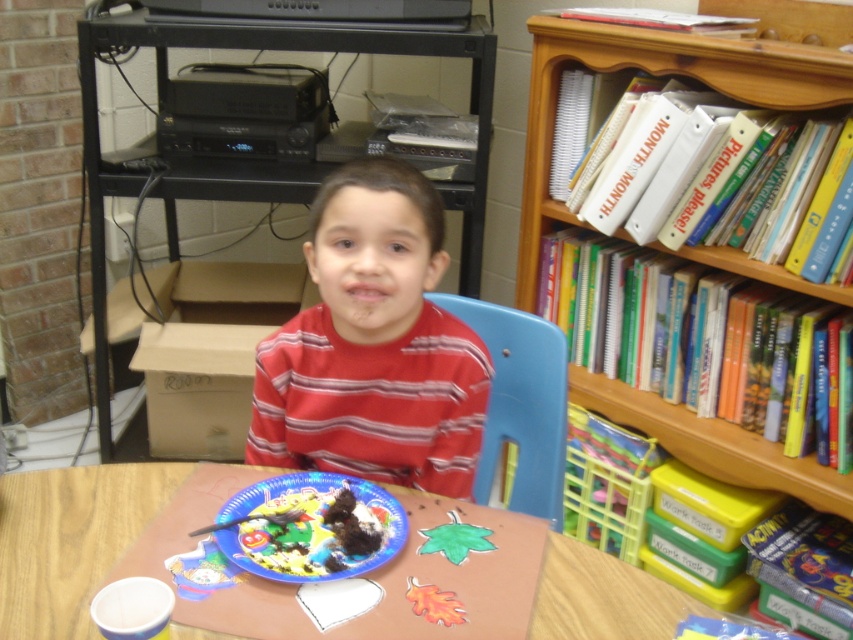
You are standing at the position of the child in the scene. Looking around, where is the wooden bookshelf at upper right located in terms of direction and distance?

The wooden bookshelf at upper right is located at the coordinates point (274, 49), which would be to the upper right direction and relatively close distance from the child.

You are a teacher in a classroom and need to move a desk between the wooden bookshelf at upper right and the blue plastic chair at center. Can you fit the desk between them?

The wooden bookshelf at upper right is positioned on the left side of blue plastic chair at center, so there is space between them. However, the description does not provide specific measurements of the distance or the desk size, making it impossible to determine if the desk will fit.

In the scene shown: You are a teacher in a classroom and need to reach a book from the wooden bookcase at upper right while standing at the brown paper table at center. Which object is higher in the image?

The wooden bookcase at upper right is located above the brown paper table at center, so it is higher in the image.